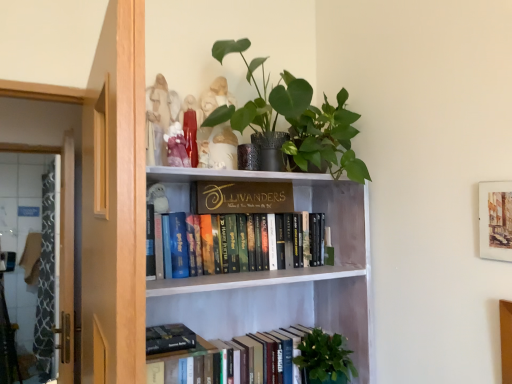
The image size is (512, 384). In order to click on vacant region above gold metallic sign at upper center (from a real-world perspective) in this screenshot , I will do `click(246, 183)`.